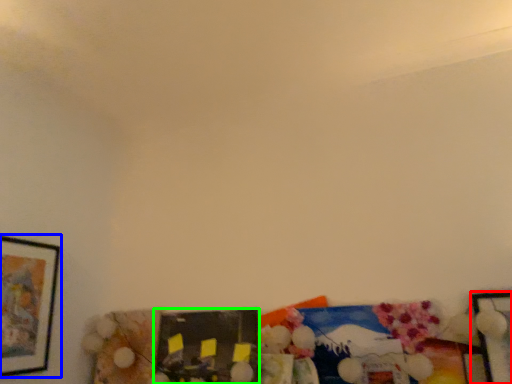
Question: Based on their relative distances, which object is nearer to picture frame (highlighted by a red box)? Choose from picture frame (highlighted by a blue box) and picture frame (highlighted by a green box).

Choices:
 (A) picture frame
 (B) picture frame

Answer: (B)